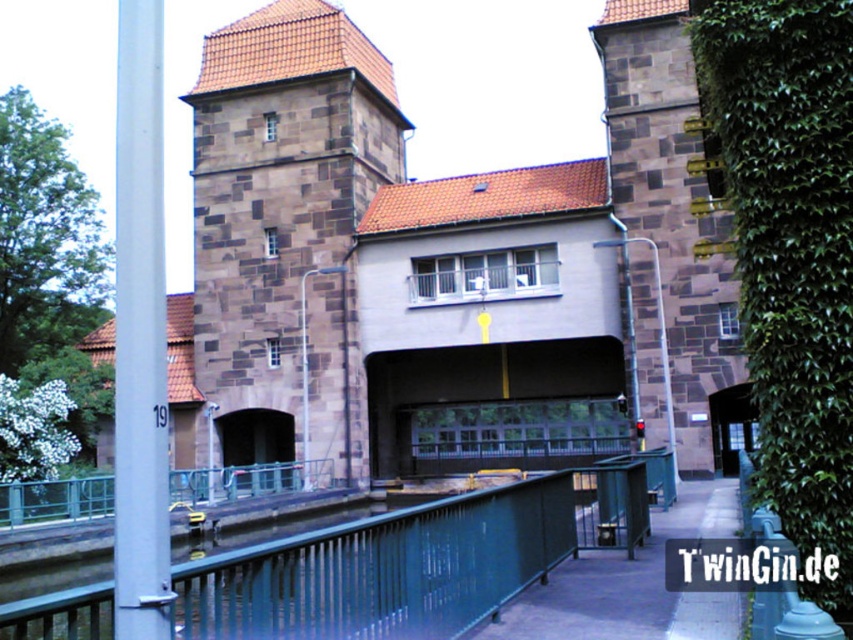
You are standing at point (283,234) in the image. What object is located exactly at your current position?

The brown stone bell tower at center is located exactly at point (283,234).

You are a tourist standing on the pathway with the green metal railing. You notice the brown stone bell tower at center and the green leafy ivy at right. Which object is taller?

The brown stone bell tower at center is much taller than the green leafy ivy at right.